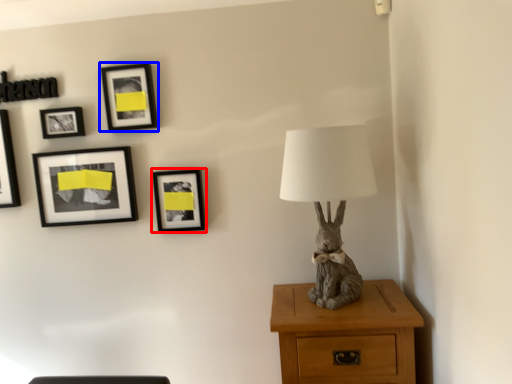
Question: Which point is closer to the camera, picture frame (highlighted by a red box) or picture frame (highlighted by a blue box)?

Choices:
 (A) picture frame
 (B) picture frame

Answer: (B)